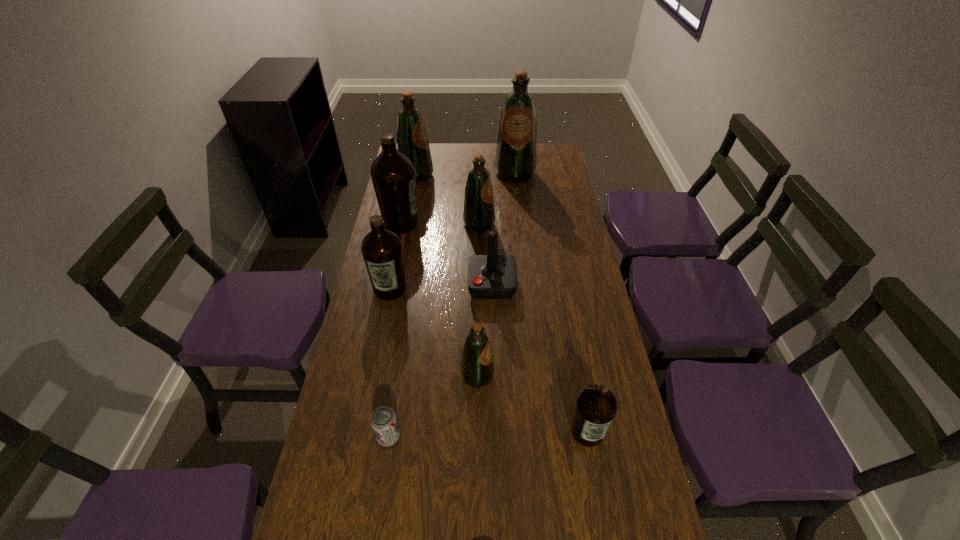
Find the location of a particular element. The height and width of the screenshot is (540, 960). the rightmost brown olive oil is located at coordinates (596, 406).

Locate an element on the screen. The width and height of the screenshot is (960, 540). the nearest olive oil is located at coordinates click(x=596, y=406).

Find the location of a particular element. the shortest object is located at coordinates (384, 423).

Where is `free space located 0.270m on the front-facing side of the tallest olive oil`? free space located 0.270m on the front-facing side of the tallest olive oil is located at coordinates (520, 222).

Find the location of `vacant point located 0.390m on the front-facing side of the leftmost green olive oil`. vacant point located 0.390m on the front-facing side of the leftmost green olive oil is located at coordinates [519, 175].

This screenshot has width=960, height=540. I want to click on free space located 0.360m on the label of the farthest brown olive oil, so click(511, 222).

This screenshot has height=540, width=960. In order to click on free point located on the front-facing side of the third farthest green olive oil in this screenshot , I will do `click(558, 224)`.

This screenshot has height=540, width=960. In order to click on vacant space located on the label of the second nearest brown olive oil in this screenshot , I will do `click(372, 381)`.

Locate an element on the screen. This screenshot has height=540, width=960. blank space located on the right of the joystick is located at coordinates (556, 285).

Locate an element on the screen. This screenshot has height=540, width=960. vacant space situated on the front-facing side of the smallest green olive oil is located at coordinates (574, 376).